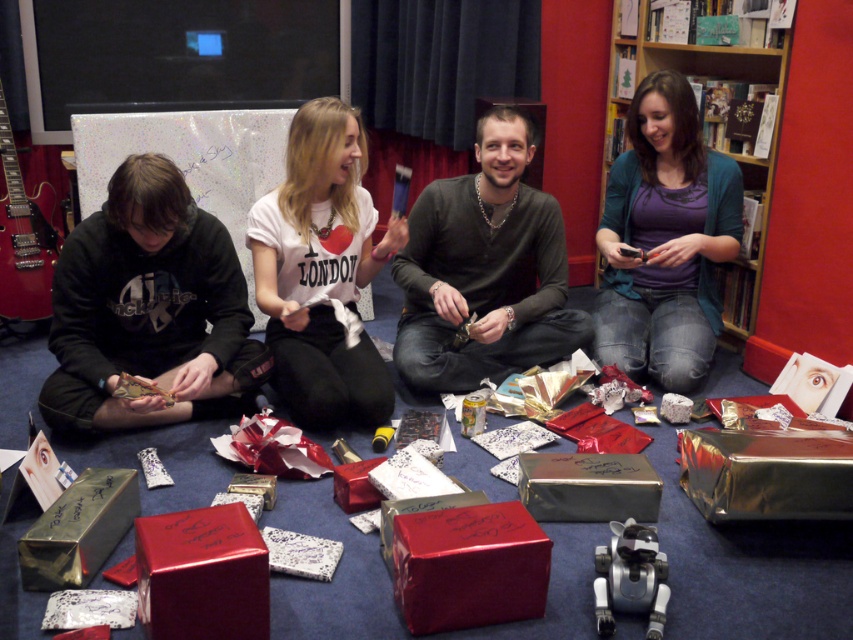
Question: Which point is farther to the camera?

Choices:
 (A) (566, 285)
 (B) (508, 612)
 (C) (285, 186)
 (D) (138, 509)

Answer: (A)

Question: Is black matte hoodie at lower left to the right of wooden bookshelf at upper right from the viewer's perspective?

Choices:
 (A) no
 (B) yes

Answer: (A)

Question: Is wooden bookshelf at upper right wider than glossy red box at center?

Choices:
 (A) no
 (B) yes

Answer: (B)

Question: Can you confirm if white cotton t-shirt at center is positioned above metallic silver gift box at lower left?

Choices:
 (A) yes
 (B) no

Answer: (A)

Question: Which of the following is the farthest from the observer?

Choices:
 (A) (556, 310)
 (B) (840, 499)
 (C) (343, 269)
 (D) (424, 522)

Answer: (A)

Question: Which object is positioned closest to the wooden bookshelf at upper right?

Choices:
 (A) metallic gold box at lower right
 (B) shiny red box at center
 (C) black matte hoodie at lower left

Answer: (A)